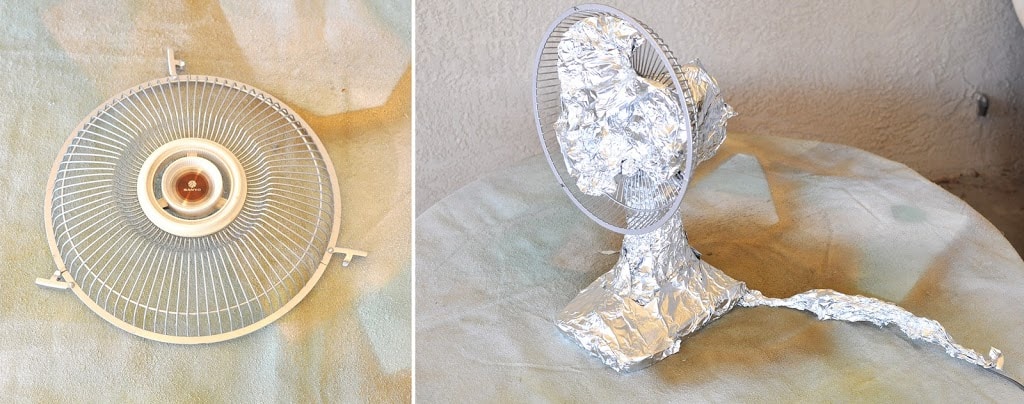
The image size is (1024, 404). I want to click on stand of fan, so click(660, 311).